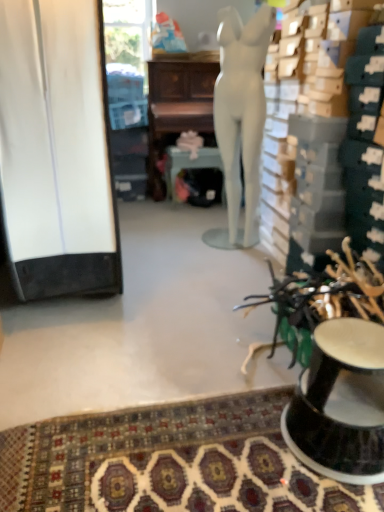
Question: Do you think white matte cabinet at left is within white matte mannequin at center, or outside of it?

Choices:
 (A) inside
 (B) outside

Answer: (B)

Question: From the image's perspective, is white matte cabinet at left located above or below white matte mannequin at center?

Choices:
 (A) below
 (B) above

Answer: (A)

Question: Considering the real-world distances, which object is farthest from the white matte mannequin at center?

Choices:
 (A) matte silver round table at center
 (B) black glossy pedestal at lower right
 (C) white matte cabinet at left
 (D) wooden desk at center
 (E) patterned carpet at lower center

Answer: (E)

Question: Which is nearer to the black glossy pedestal at lower right?

Choices:
 (A) wooden desk at center
 (B) white matte mannequin at center
 (C) matte silver round table at center
 (D) patterned carpet at lower center
 (E) white matte cabinet at left

Answer: (D)